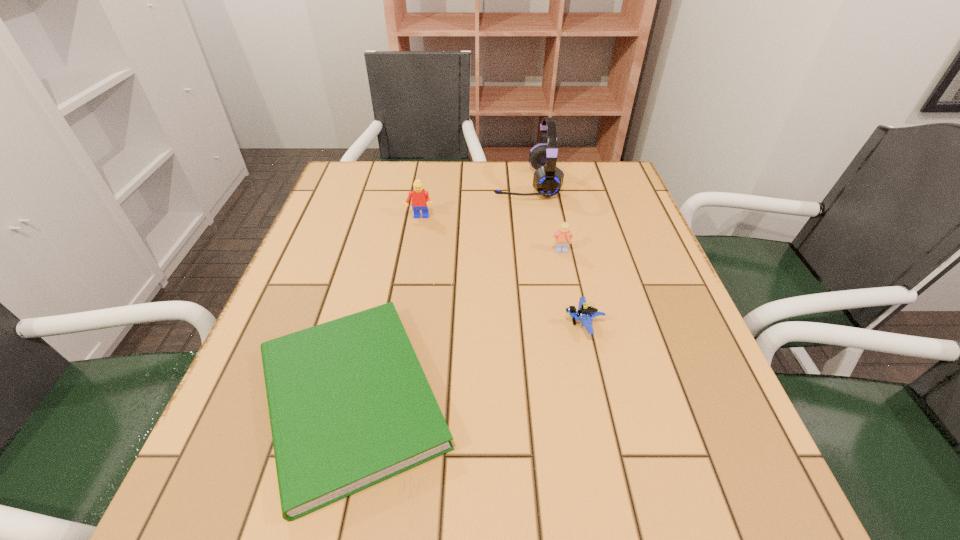
Image resolution: width=960 pixels, height=540 pixels. I want to click on headset, so click(548, 179).

This screenshot has height=540, width=960. Identify the location of the farthest object. (548, 179).

At what (x,y) coordinates should I click in order to perform the action: click on the farthest Lego. Please return your answer as a coordinate pair (x, y). The image size is (960, 540). Looking at the image, I should click on (420, 198).

I want to click on the fourth shortest object, so click(420, 198).

Locate an element on the screen. This screenshot has height=540, width=960. the third nearest object is located at coordinates (562, 238).

Locate an element on the screen. the second tallest Lego is located at coordinates (562, 238).

Locate an element on the screen. the nearest Lego is located at coordinates (585, 313).

Where is `the shortest Lego`? Image resolution: width=960 pixels, height=540 pixels. the shortest Lego is located at coordinates coord(585,313).

Find the location of a particular element. the shortest object is located at coordinates (349, 404).

This screenshot has height=540, width=960. Identify the location of free space located 0.240m on the ear cushions of the tallest object. (409, 183).